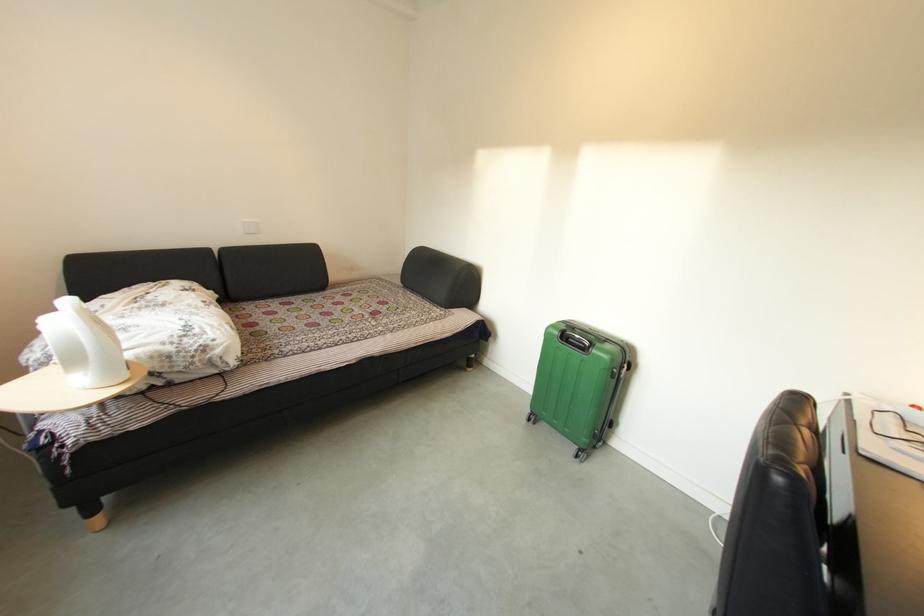
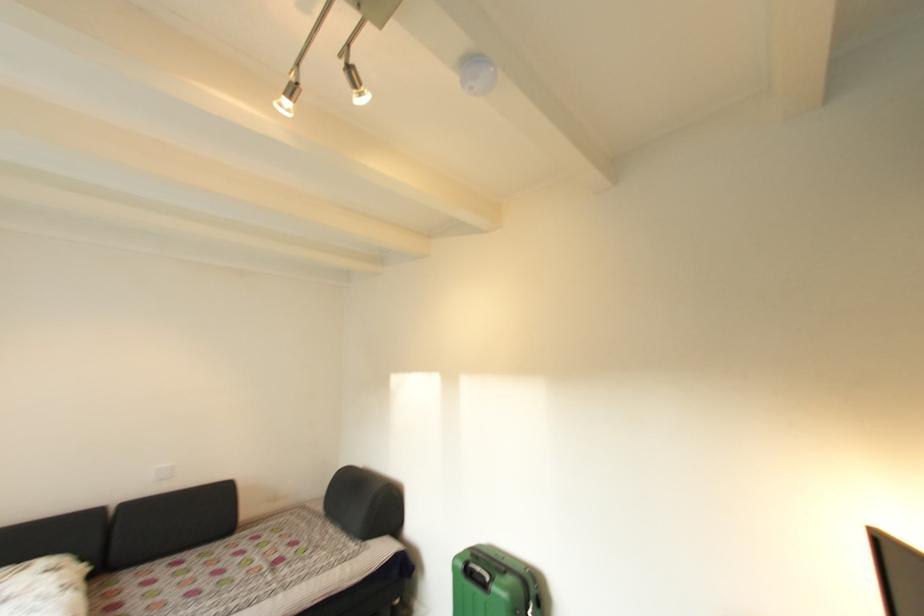
In the second image, find the point that corresponds to (419,296) in the first image.

(341, 525)